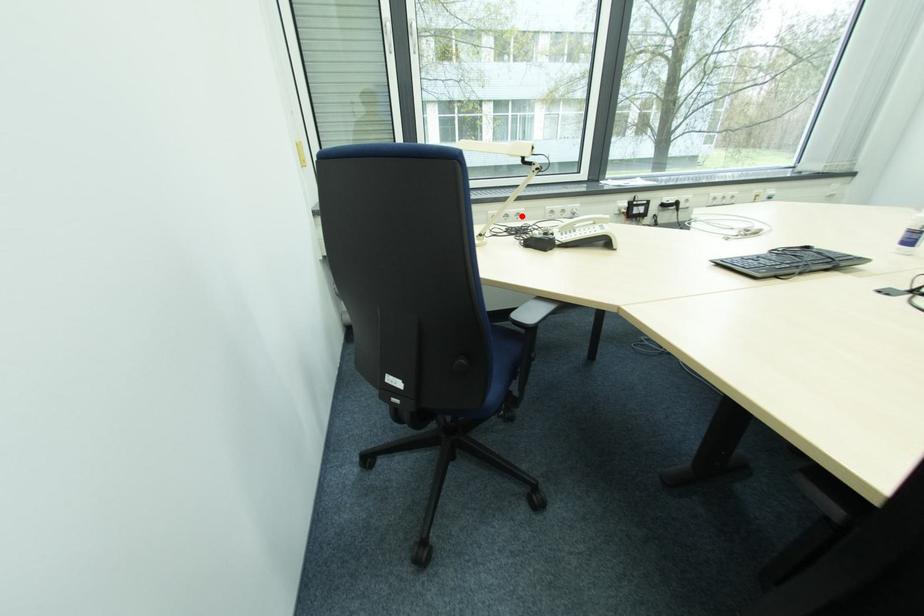
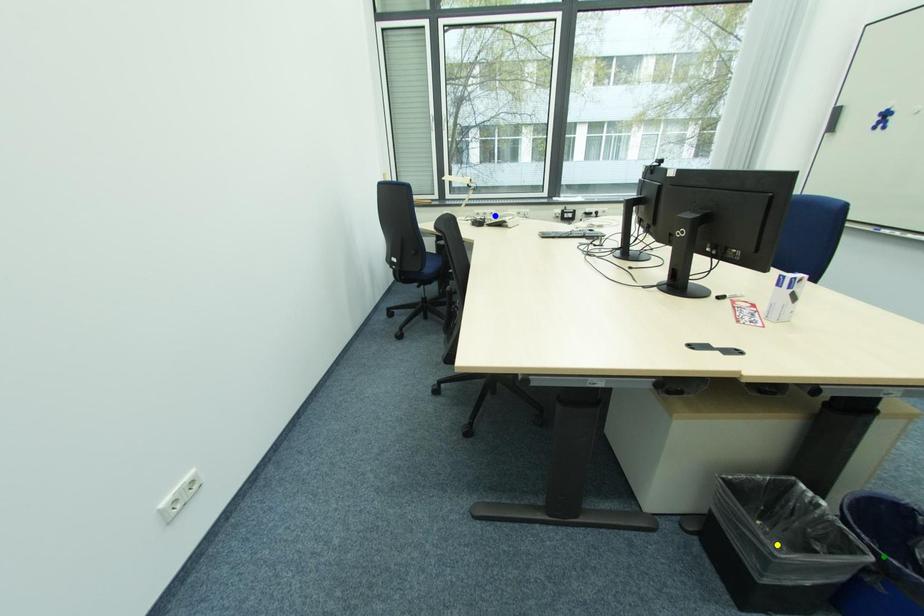
Question: I am providing you with two images of the same scene from different viewpoints. A red point is marked on the first image. You are given multiple points on the second image. In image 2, which mark is for the same physical point as the one in image 1?

Choices:
 (A) blue point
 (B) green point
 (C) yellow point

Answer: (A)